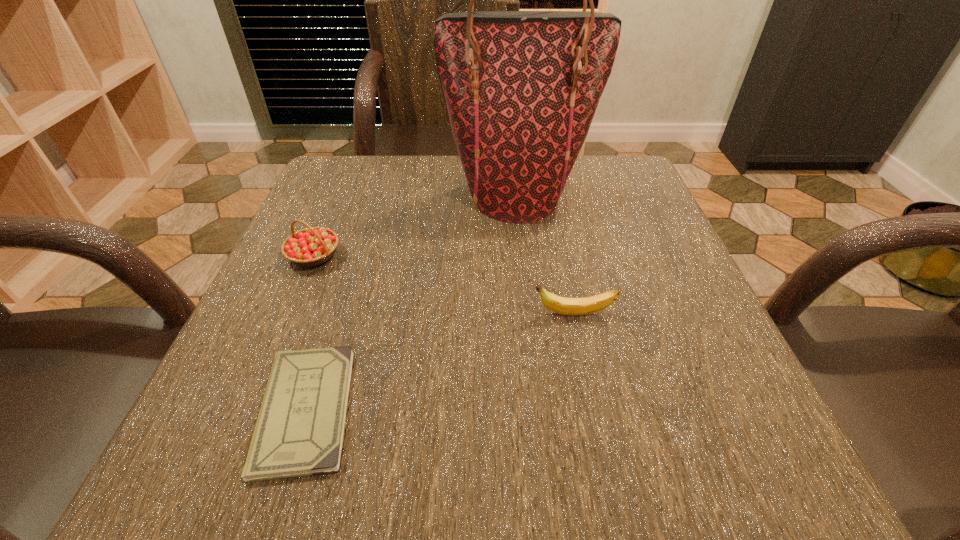
Identify the location of the tallest object. The height and width of the screenshot is (540, 960). (521, 87).

In order to click on handbag in this screenshot , I will do [521, 87].

The height and width of the screenshot is (540, 960). In order to click on strawberry in this screenshot , I will do [312, 246].

Image resolution: width=960 pixels, height=540 pixels. I want to click on the second tallest object, so click(312, 246).

This screenshot has width=960, height=540. I want to click on the second shortest object, so click(566, 306).

What are the coordinates of `banana` in the screenshot? It's located at (566, 306).

Identify the location of the nearest object. The width and height of the screenshot is (960, 540). (300, 429).

You are a GUI agent. You are given a task and a screenshot of the screen. Output one action in this format:
    pyautogui.click(x=<x>, y=<y>)
    Task: Click on the shortest object
    This screenshot has height=540, width=960.
    Given the screenshot: What is the action you would take?
    pyautogui.click(x=300, y=429)

Where is `vacant region located on the front of the handbag`? Image resolution: width=960 pixels, height=540 pixels. vacant region located on the front of the handbag is located at coordinates (532, 336).

Locate an element on the screen. free space located on the right of the second farthest object is located at coordinates (462, 256).